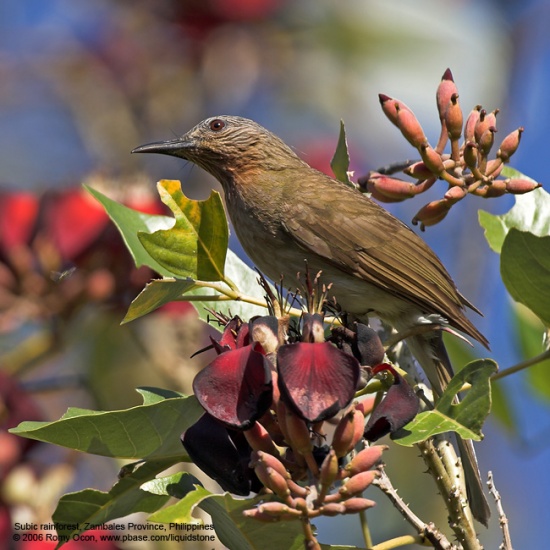
This screenshot has width=550, height=550. Find the location of `plant`. plant is located at coordinates (436, 477).